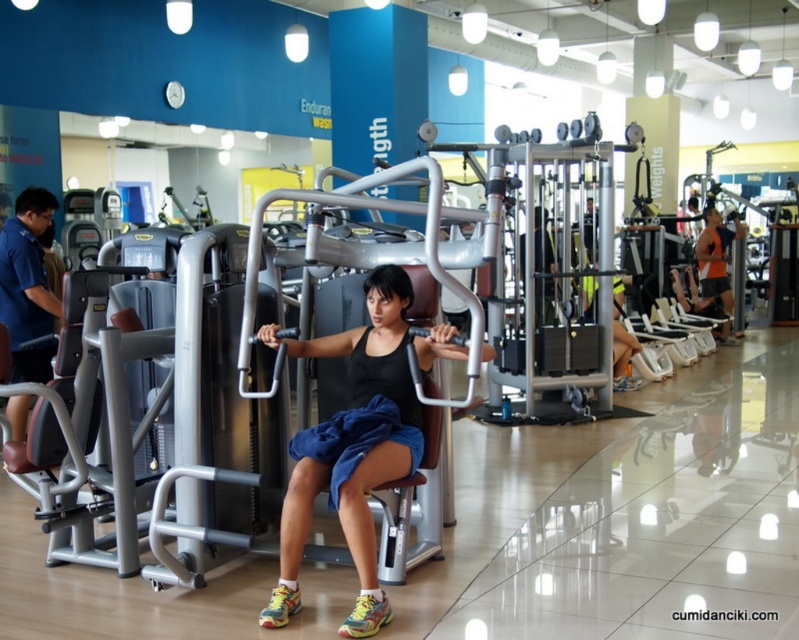
Question: Among these objects, which one is farthest from the camera?

Choices:
 (A) blue fabric shirt at left
 (B) orange mesh tank top at center
 (C) black matte tank top at center

Answer: (B)

Question: Can you confirm if black matte tank top at center is smaller than orange mesh tank top at center?

Choices:
 (A) no
 (B) yes

Answer: (A)

Question: Is blue fabric shirt at left thinner than orange mesh tank top at center?

Choices:
 (A) no
 (B) yes

Answer: (A)

Question: Which of the following is the farthest from the observer?

Choices:
 (A) (38, 260)
 (B) (340, 339)
 (C) (702, 228)

Answer: (C)

Question: Among these points, which one is farthest from the camera?

Choices:
 (A) (344, 532)
 (B) (726, 282)

Answer: (B)

Question: Can you confirm if blue fabric shirt at left is positioned to the right of orange mesh tank top at center?

Choices:
 (A) yes
 (B) no

Answer: (B)